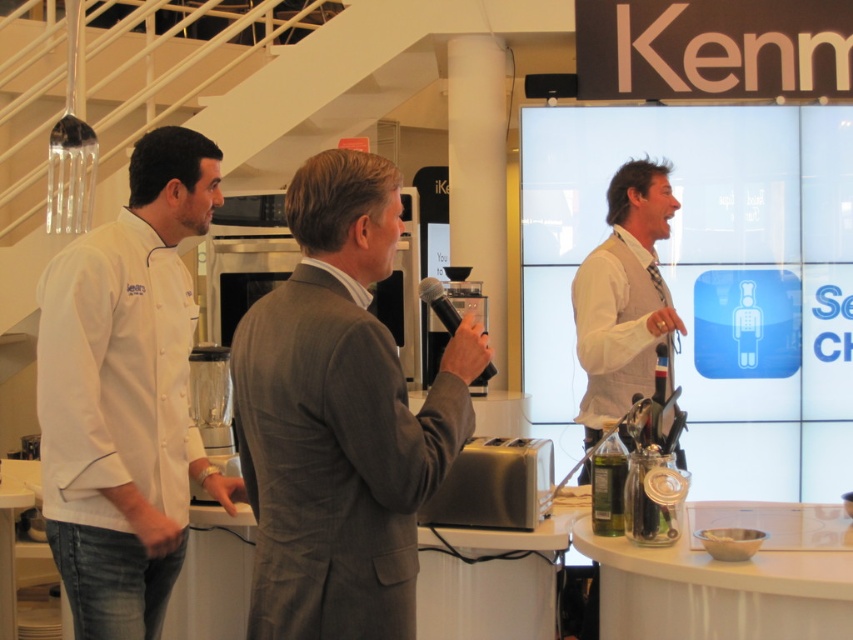
You are standing in the kitchen scene and notice two points marked in the image. Which of the two points, point (366, 394) or point (618, 403), is closer to you?

Point (366, 394) is closer to the viewer than point (618, 403).

You are standing in the kitchen scene and want to determine which of the two points, point (138, 324) or point (579, 276), is nearer to you. Based on the spatial information provided, which point is closer?

Point (138, 324) is closer to the viewer than point (579, 276).